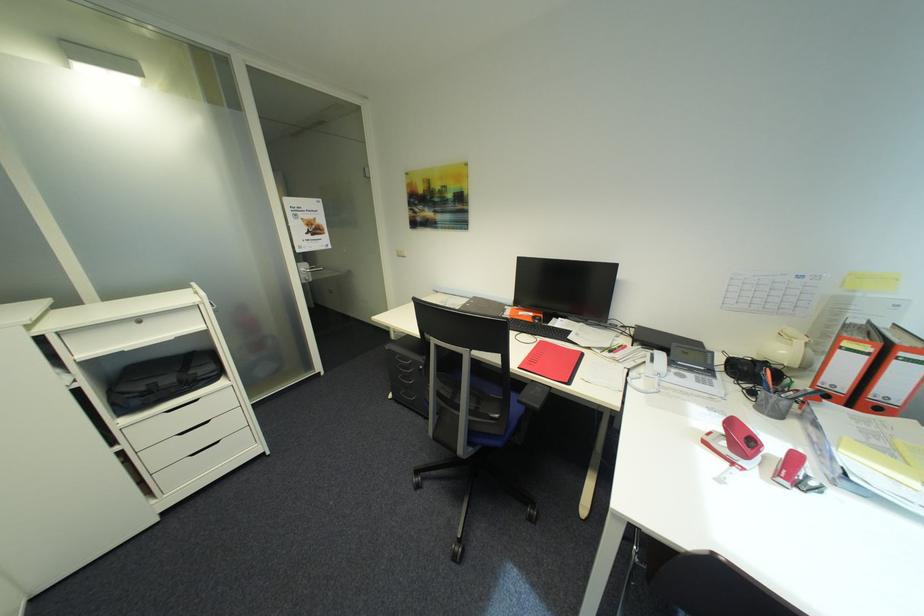
Image resolution: width=924 pixels, height=616 pixels. Identify the location of drawer lock. (736, 427).